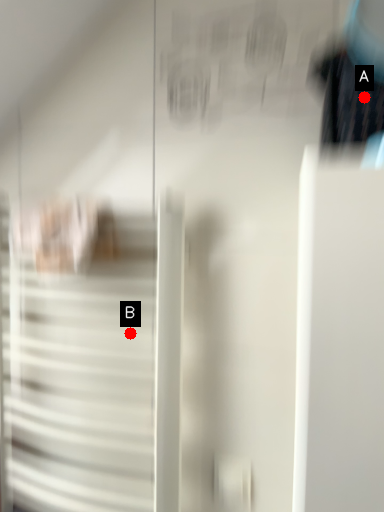
Question: Two points are circled on the image, labeled by A and B beside each circle. Which point is closer to the camera?

Choices:
 (A) A is closer
 (B) B is closer

Answer: (A)